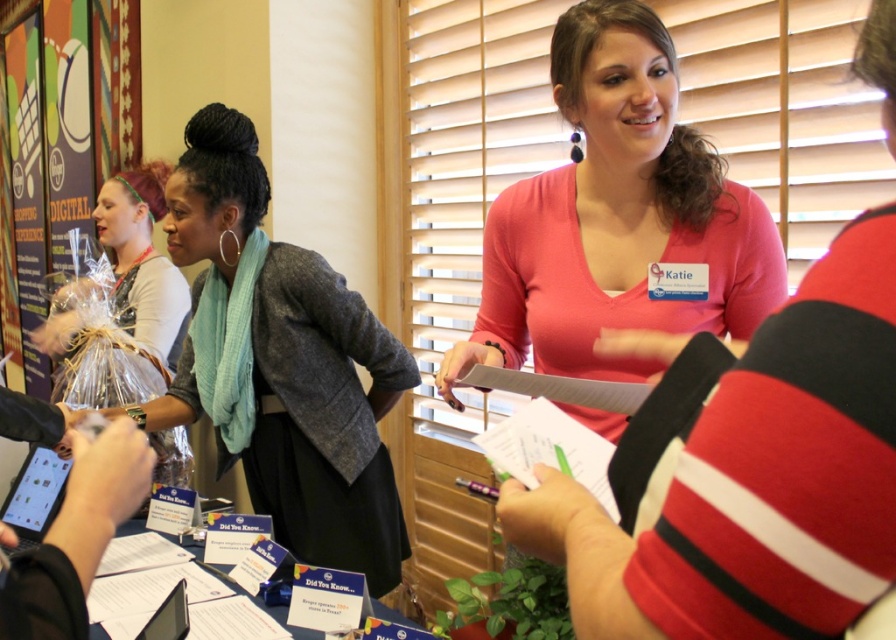
Which of these two, pink matte shirt at center or gray woolen jacket at center, stands taller?

Standing taller between the two is gray woolen jacket at center.

Is pink matte shirt at center taller than gray woolen jacket at center?

No, pink matte shirt at center is not taller than gray woolen jacket at center.

The width and height of the screenshot is (896, 640). I want to click on pink matte shirt at center, so click(x=618, y=220).

Locate an element on the screen. Image resolution: width=896 pixels, height=640 pixels. pink matte shirt at center is located at coordinates (618, 220).

What do you see at coordinates (618, 220) in the screenshot?
I see `pink matte shirt at center` at bounding box center [618, 220].

Between point (570, 26) and point (55, 36), which one is positioned behind?

Positioned behind is point (55, 36).

Who is more distant from viewer, (544, 369) or (126, 124)?

The point (126, 124) is behind.

Where is `pink matte shirt at center`? pink matte shirt at center is located at coordinates (618, 220).

Looking at this image, can you confirm if gray woolen jacket at center is positioned to the right of plastic wrapped bouquet at left?

Correct, you'll find gray woolen jacket at center to the right of plastic wrapped bouquet at left.

Does gray woolen jacket at center lie behind plastic wrapped bouquet at left?

No, gray woolen jacket at center is in front of plastic wrapped bouquet at left.

Locate an element on the screen. gray woolen jacket at center is located at coordinates point(281,364).